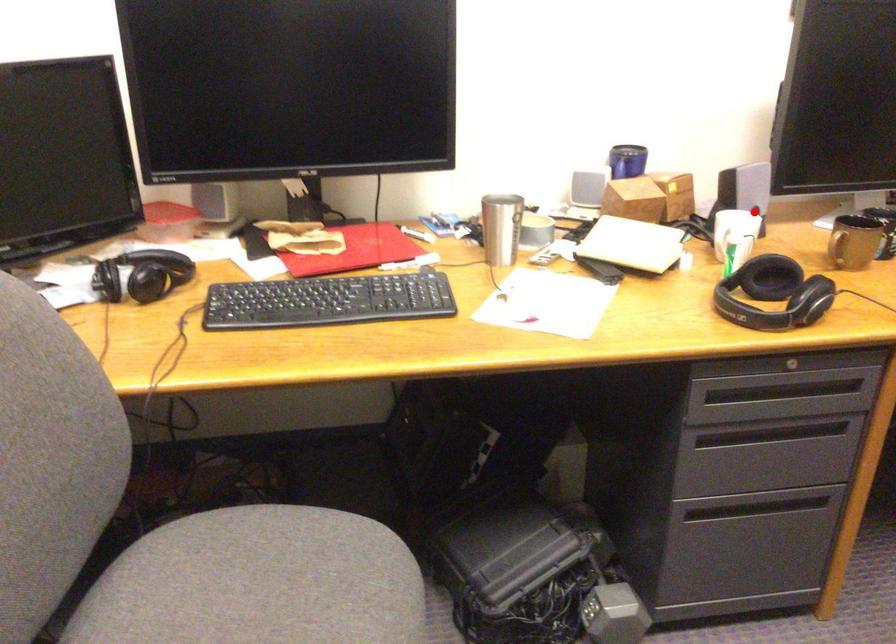
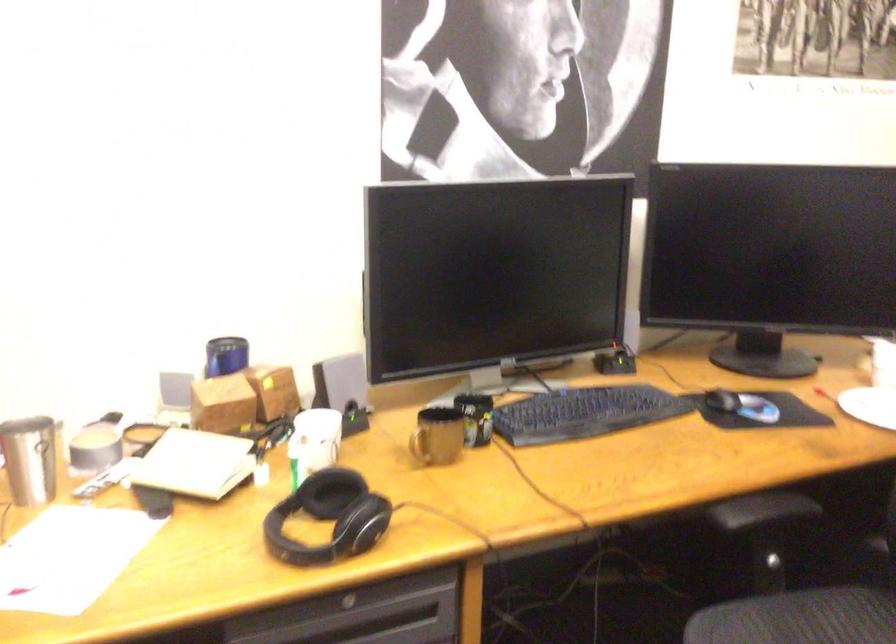
Question: I am providing you with two images of the same scene from different viewpoints. A red point is marked on the first image. At the location where the point appears in image 1, is it still visible in image 2?

Choices:
 (A) Yes
 (B) No

Answer: (A)